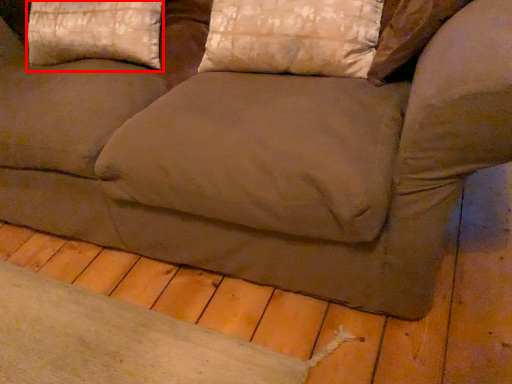
Question: From the image's perspective, where is pillow (annotated by the red box) located relative to pillow?

Choices:
 (A) above
 (B) below

Answer: (A)